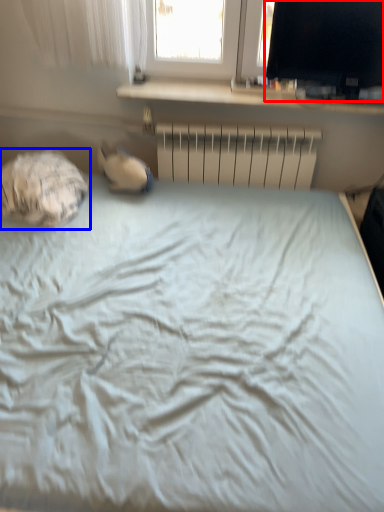
Question: Which of the following is the closest to the observer, computer monitor (highlighted by a red box) or sleeping bag (highlighted by a blue box)?

Choices:
 (A) computer monitor
 (B) sleeping bag

Answer: (B)